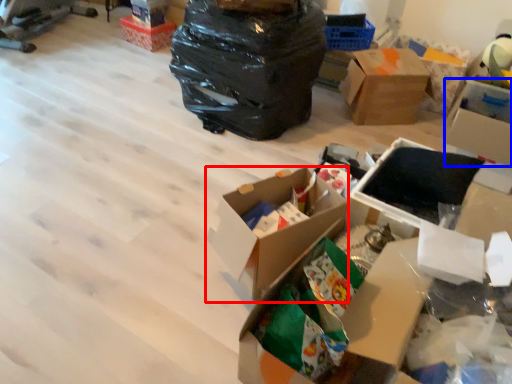
Question: Which object is further to the camera taking this photo, box (highlighted by a red box) or box (highlighted by a blue box)?

Choices:
 (A) box
 (B) box

Answer: (B)